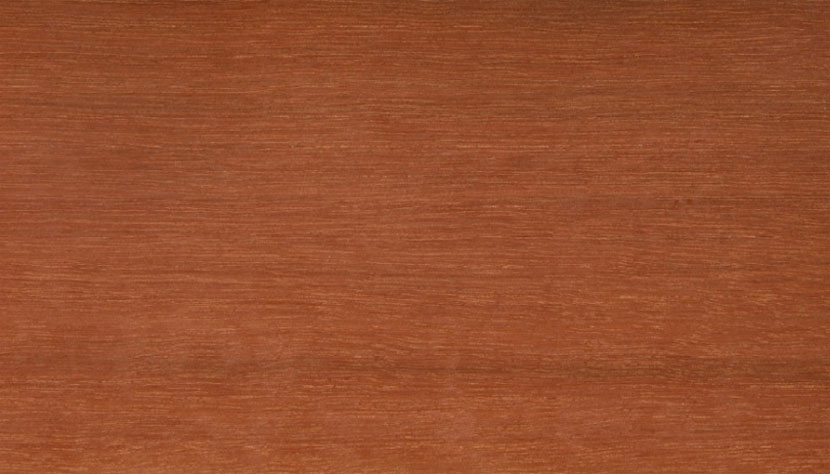
Where is `corner`? corner is located at coordinates tap(804, 454), tap(811, 22), tap(12, 45), tap(23, 450).